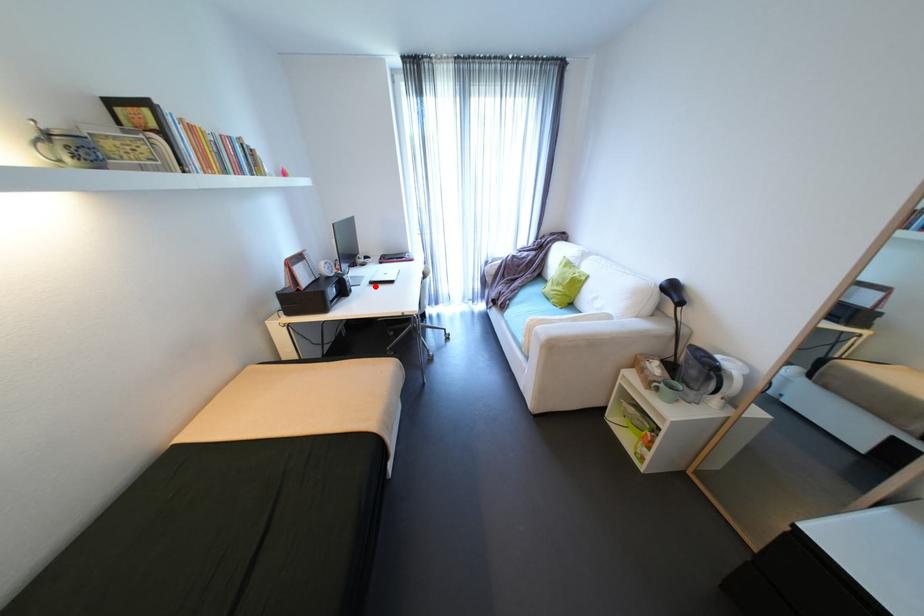
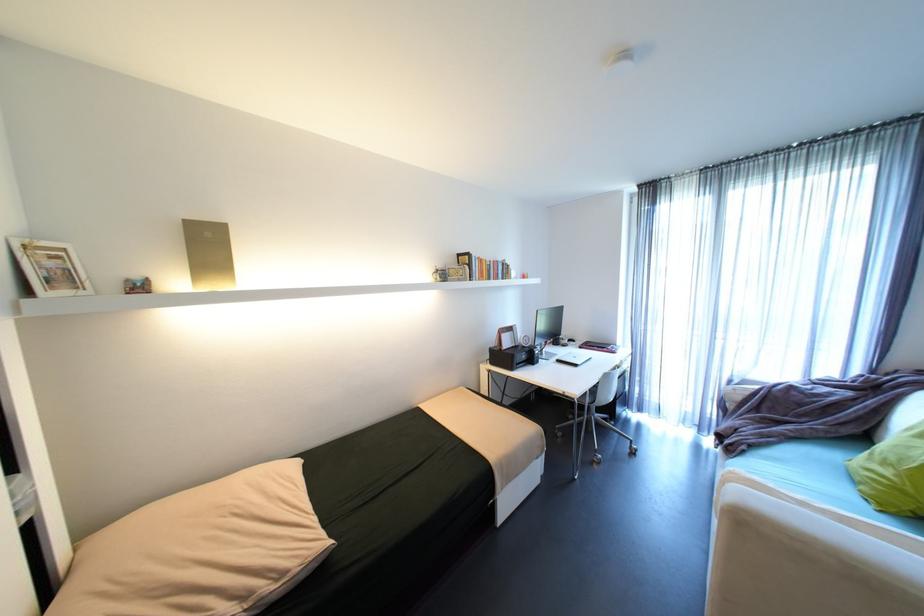
Question: I am providing you with two images of the same scene from different viewpoints. In image1, a red point is highlighted. Considering the same 3D point in image2, which of the following is correct?

Choices:
 (A) It is closer
 (B) It is farther

Answer: (B)